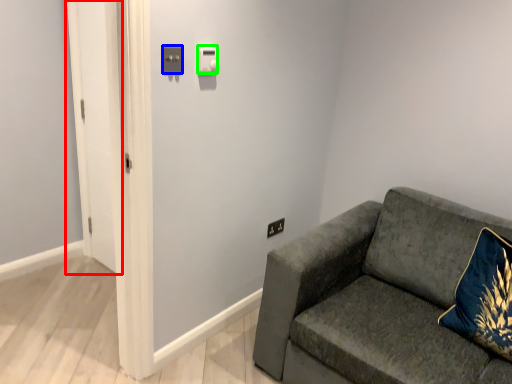
Question: Considering the real-world distances, which object is closest to glass door (highlighted by a red box)? light switch (highlighted by a blue box) or light switch (highlighted by a green box).

Choices:
 (A) light switch
 (B) light switch

Answer: (B)